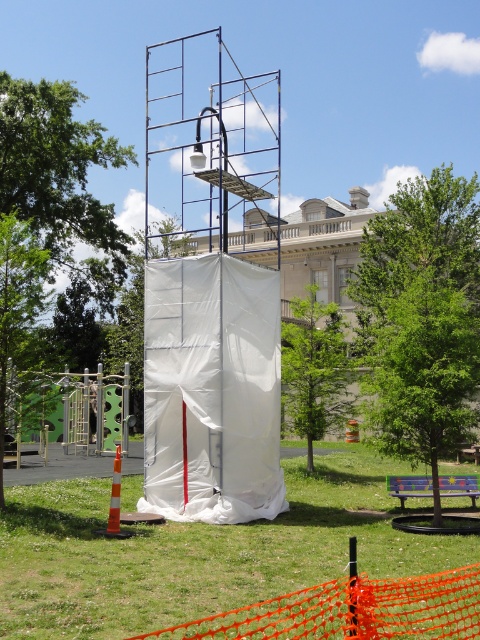
Question: Does green grass at lower center appear on the right side of white fabric tent at center?

Choices:
 (A) no
 (B) yes

Answer: (B)

Question: Which point is farther to the camera?

Choices:
 (A) orange traffic cone at lower left
 (B) white fabric tent at center
 (C) green grass at lower center

Answer: (B)

Question: Considering the real-world distances, which object is farthest from the green grass at lower center?

Choices:
 (A) orange traffic cone at lower left
 (B) white fabric tent at center

Answer: (A)

Question: Which object appears closest to the camera in this image?

Choices:
 (A) green grass at lower center
 (B) white fabric tent at center
 (C) orange traffic cone at lower left

Answer: (A)

Question: Can you confirm if green grass at lower center is positioned below white fabric tent at center?

Choices:
 (A) no
 (B) yes

Answer: (B)

Question: Can you confirm if green grass at lower center is positioned to the right of orange traffic cone at lower left?

Choices:
 (A) no
 (B) yes

Answer: (B)